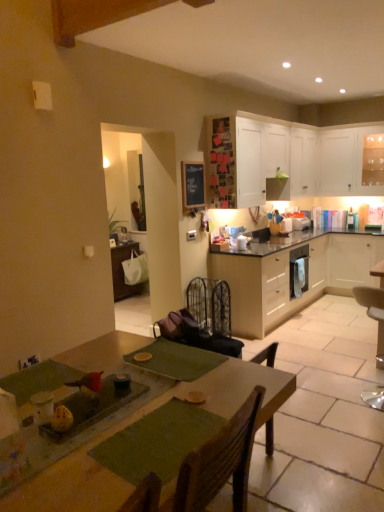
Question: From a real-world perspective, is white matte cabinet at upper right, the 1th cabinetry viewed from the top, above or below black wrought iron armchair at center?

Choices:
 (A) below
 (B) above

Answer: (B)

Question: In terms of width, does white matte cabinet at upper right, which is the 4th cabinetry from bottom to top, look wider or thinner when compared to black wrought iron armchair at center?

Choices:
 (A) thin
 (B) wide

Answer: (B)

Question: Which is nearer to the light wood/veneer cabinets at center, the 4th cabinetry from the top?

Choices:
 (A) white matte cabinet at upper right, which is the 4th cabinetry from bottom to top
 (B) white matte cabinet at right, the 3th cabinetry viewed from the top
 (C) white matte cabinet at upper center, placed as the third cabinetry when sorted from bottom to top
 (D) metallic silver chair at lower right
 (E) white glossy microwave at upper right, which is counted as the second appliance, starting from the back

Answer: (B)

Question: Which object is the farthest from the white matte cabinet at right, which appears as the second cabinetry when ordered from the bottom?

Choices:
 (A) white matte cabinet at upper center, the second cabinetry in the top-to-bottom sequence
 (B) white glossy microwave at upper right, the second appliance positioned from the front
 (C) light wood/veneer cabinets at center, the 1th cabinetry when ordered from bottom to top
 (D) white matte cabinet at upper right, which is the 4th cabinetry from bottom to top
 (E) white glossy microwave at upper right, which is counted as the second appliance, starting from the back

Answer: (A)